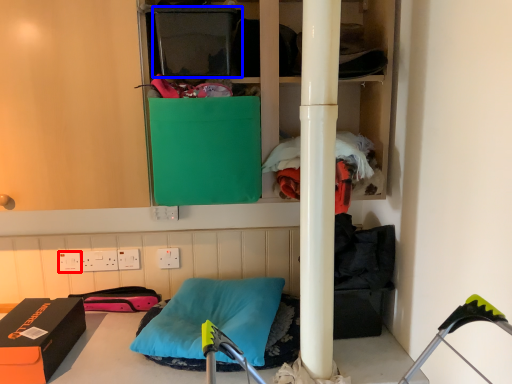
Question: Which object is further to the camera taking this photo, electric outlet (highlighted by a red box) or box (highlighted by a blue box)?

Choices:
 (A) electric outlet
 (B) box

Answer: (A)